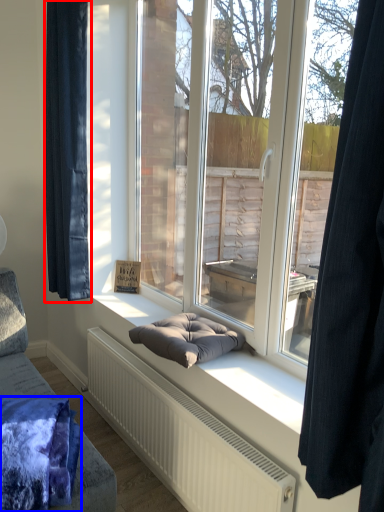
Question: Which point is closer to the camera, curtain (highlighted by a red box) or blanket (highlighted by a blue box)?

Choices:
 (A) curtain
 (B) blanket

Answer: (B)